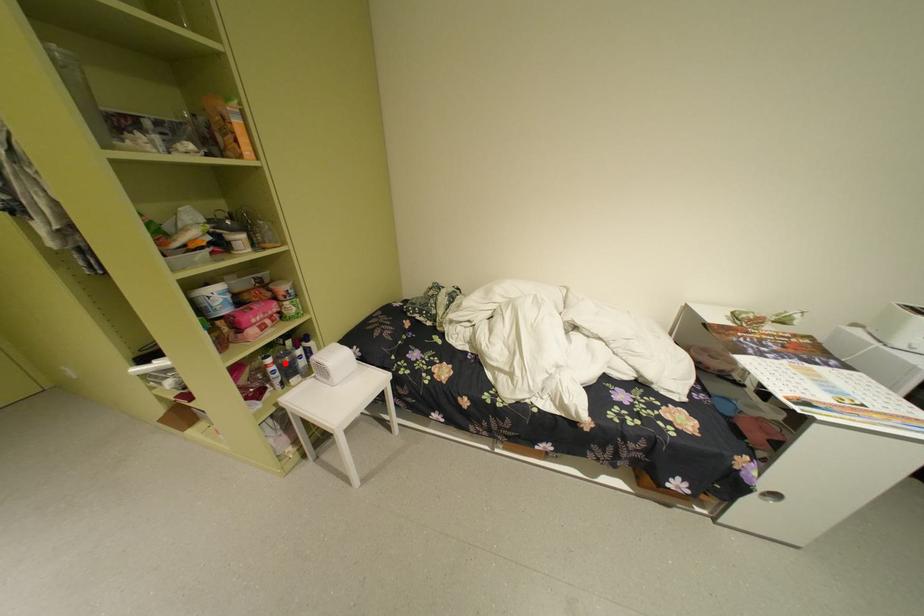
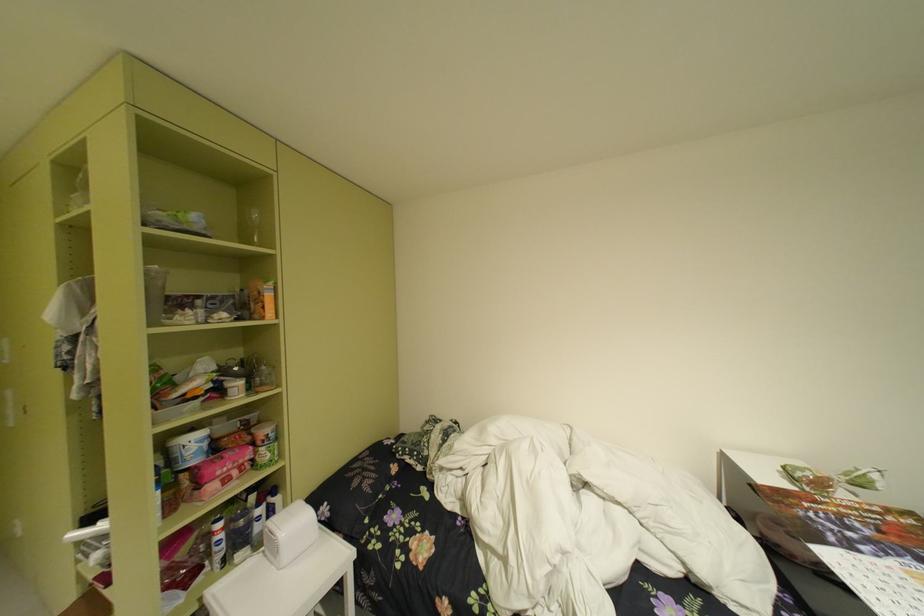
Find the pixel in the second image that matches the highlighted location in the first image.

(235, 528)